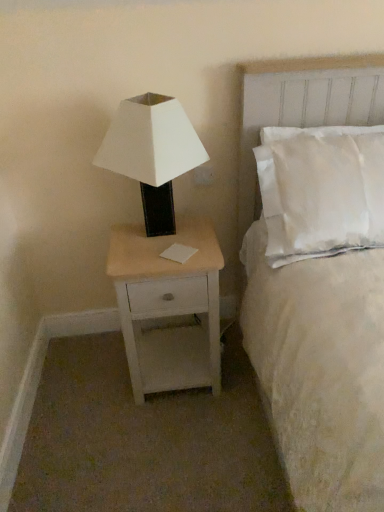
Where is `free location in front of light wood/white painted nightstand at lower left`? The height and width of the screenshot is (512, 384). free location in front of light wood/white painted nightstand at lower left is located at coordinates (177, 439).